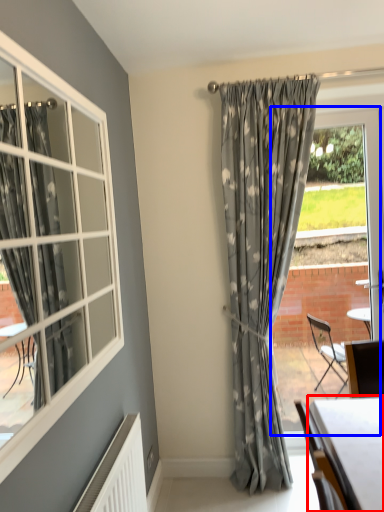
Question: Which object appears closest to the camera in this image, table (highlighted by a red box) or window frame (highlighted by a blue box)?

Choices:
 (A) table
 (B) window frame

Answer: (A)